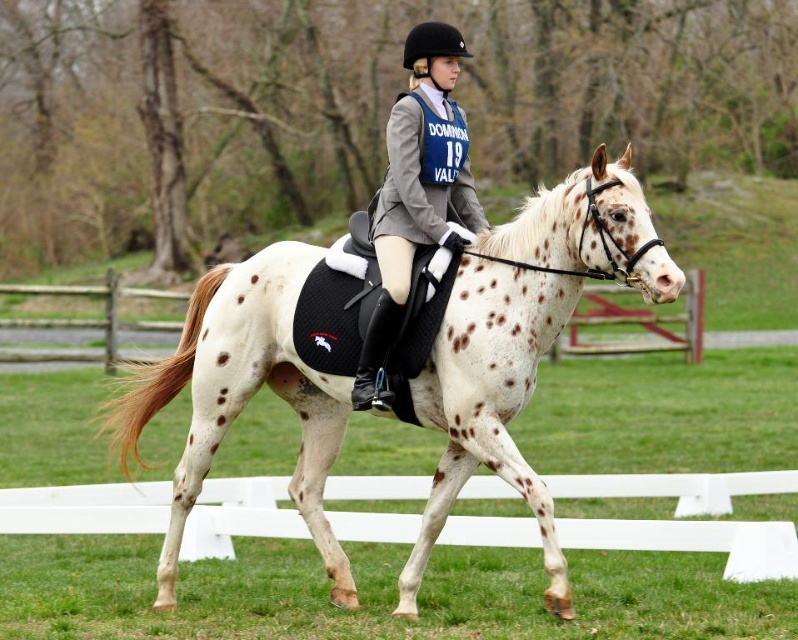
Which is in front, point (539, 196) or point (445, 131)?

Positioned in front is point (539, 196).

Who is taller, speckled white horse at center or matte gray jacket at center?

matte gray jacket at center

At what (x,y) coordinates should I click in order to perform the action: click on speckled white horse at center. Please return your answer as a coordinate pair (x, y). Looking at the image, I should click on (524, 340).